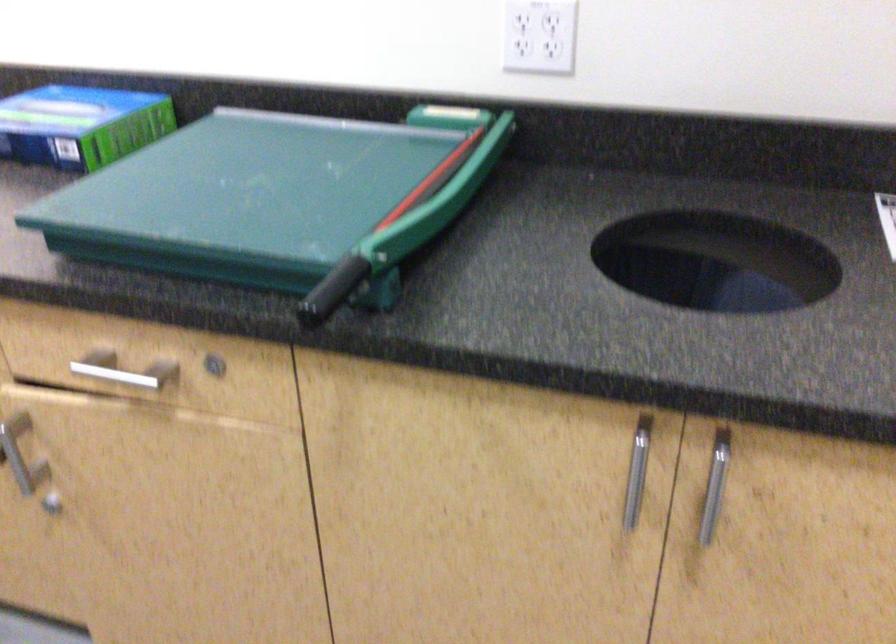
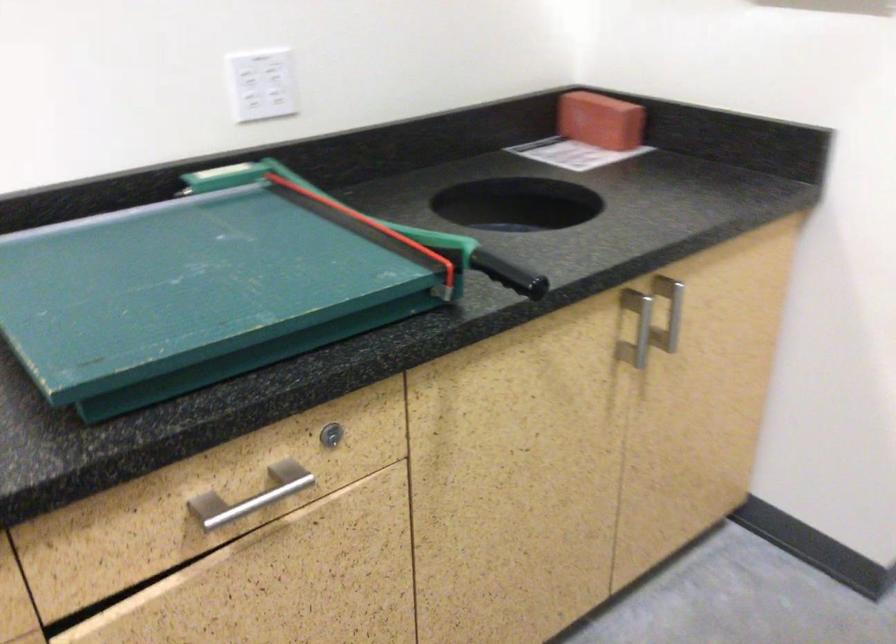
Find the pixel in the second image that matches (220,361) in the first image.

(331, 435)